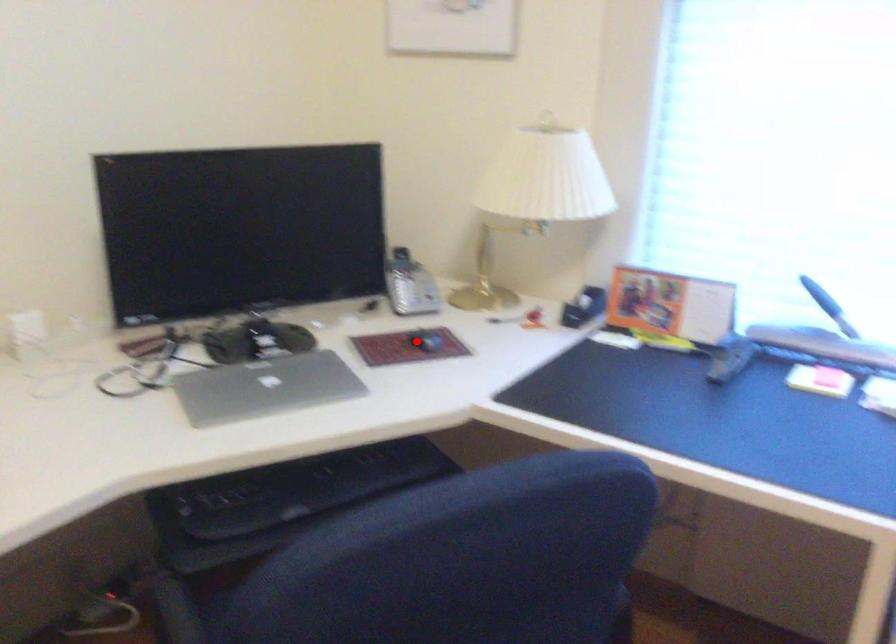
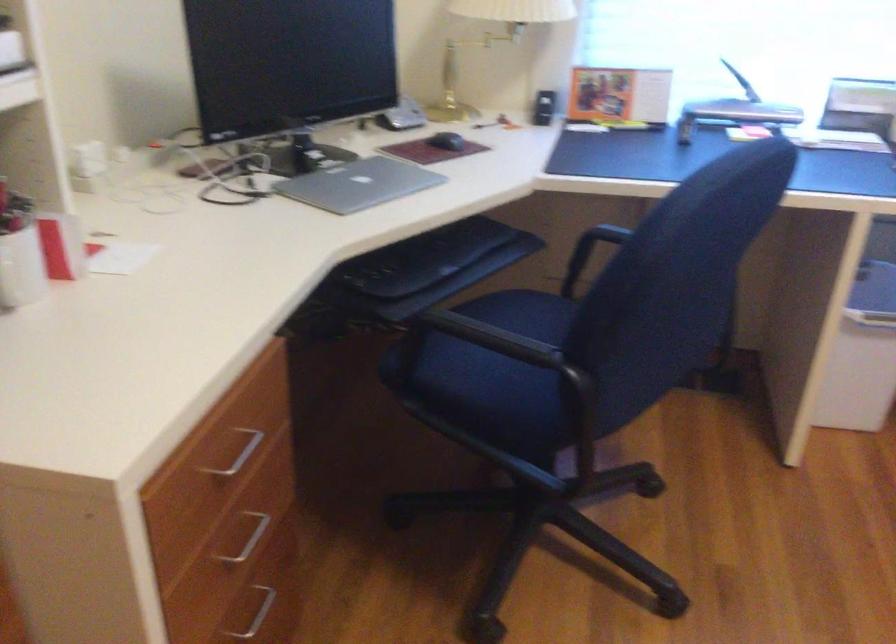
Question: I am providing you with two images of the same scene from different viewpoints. A red point is shown in image1. For the corresponding object point in image2, is it positioned nearer or farther from the camera?

Choices:
 (A) Nearer
 (B) Farther

Answer: (B)